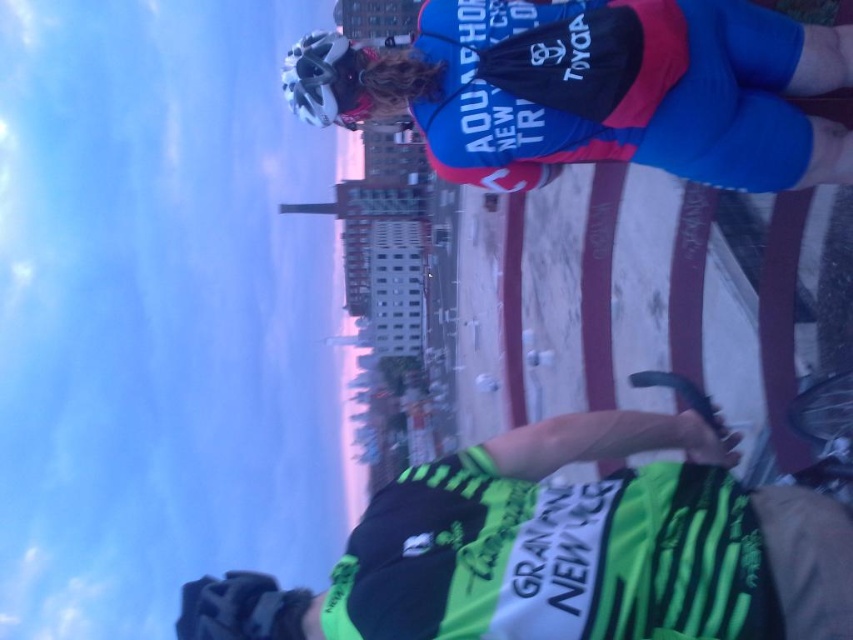
Question: Which object is the closest to the white matte bicycle helmet at upper center?

Choices:
 (A) matte blue helmet at upper center
 (B) green striped jersey at lower right

Answer: (A)

Question: Which point is closer to the camera?

Choices:
 (A) white matte bicycle helmet at upper center
 (B) matte blue helmet at upper center
 (C) green striped jersey at lower right

Answer: (C)

Question: Considering the relative positions of green striped jersey at lower right and white matte bicycle helmet at upper center in the image provided, where is green striped jersey at lower right located with respect to white matte bicycle helmet at upper center?

Choices:
 (A) left
 (B) right

Answer: (B)

Question: Which point appears closest to the camera in this image?

Choices:
 (A) (368, 560)
 (B) (810, 140)

Answer: (A)

Question: Considering the relative positions of green striped jersey at lower right and white matte bicycle helmet at upper center in the image provided, where is green striped jersey at lower right located with respect to white matte bicycle helmet at upper center?

Choices:
 (A) below
 (B) above

Answer: (A)

Question: Where is matte blue helmet at upper center located in relation to white matte bicycle helmet at upper center in the image?

Choices:
 (A) below
 (B) above

Answer: (A)